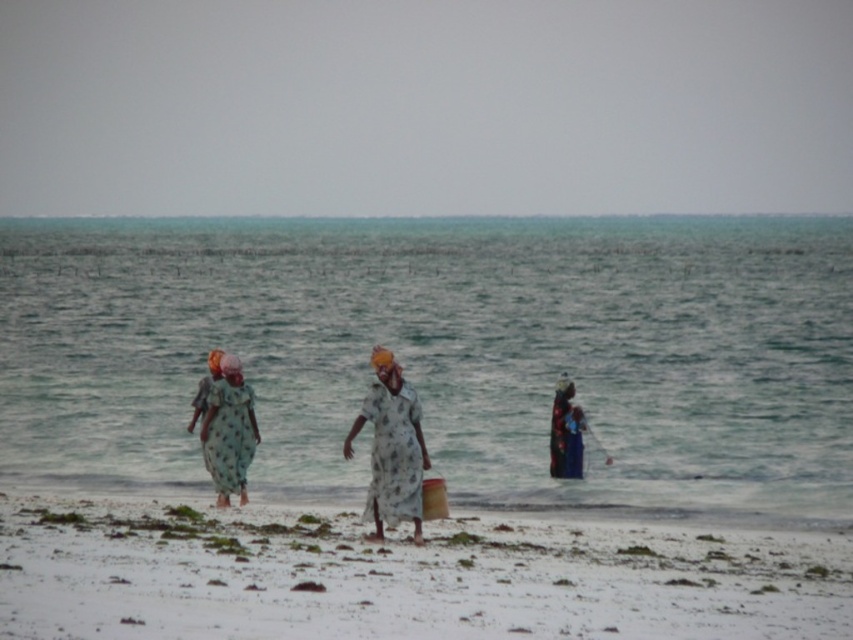
Which is in front, point (688, 243) or point (202, 444)?

Point (202, 444)

Who is lower down, clear water at center or printed fabric dress at left?

printed fabric dress at left

You are a GUI agent. You are given a task and a screenshot of the screen. Output one action in this format:
    pyautogui.click(x=<x>, y=<y>)
    Task: Click on the clear water at center
    The height and width of the screenshot is (640, 853).
    Given the screenshot: What is the action you would take?
    pyautogui.click(x=444, y=353)

Identify the location of clear water at center. (444, 353).

Does point (376, 465) come in front of point (242, 442)?

Yes, point (376, 465) is closer to viewer.

Describe the element at coordinates (392, 448) in the screenshot. I see `white floral dress at center` at that location.

Locate an element on the screen. The image size is (853, 640). white floral dress at center is located at coordinates (392, 448).

Can you confirm if white sandy beach at lower center is wider than blue fabric dress at center?

Yes, white sandy beach at lower center is wider than blue fabric dress at center.

Which is behind, point (596, 520) or point (572, 438)?

The point (572, 438) is more distant.

Find the location of a particular element. white sandy beach at lower center is located at coordinates (399, 576).